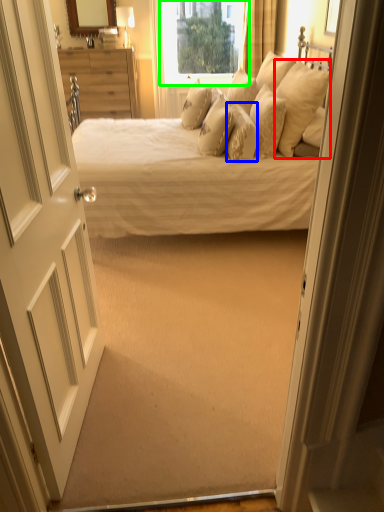
Question: Considering the real-world distances, which object is farthest from pillow (highlighted by a red box)? pillow (highlighted by a blue box) or window (highlighted by a green box)?

Choices:
 (A) pillow
 (B) window

Answer: (B)